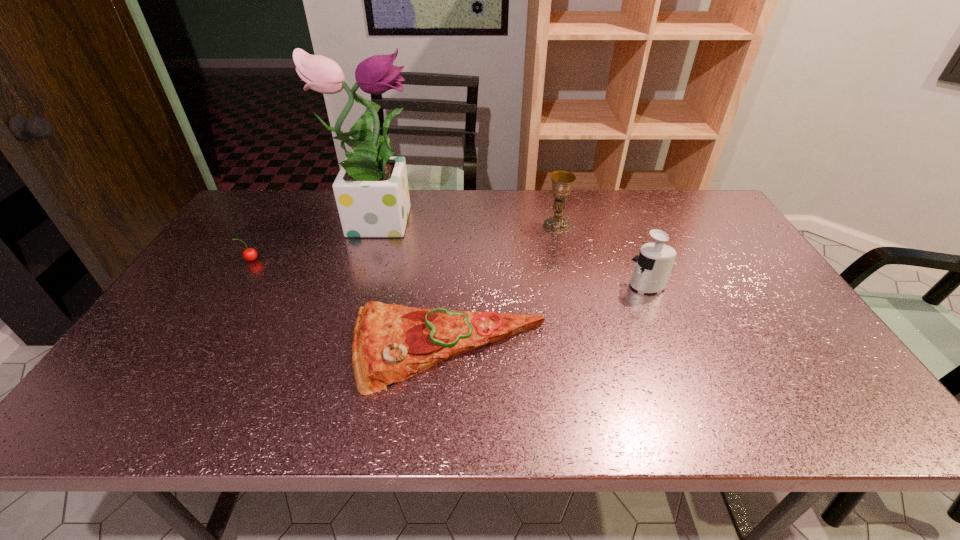
Locate an element on the screen. free spot located on the left of the juicer is located at coordinates (580, 286).

Locate an element on the screen. free spot located 0.120m on the front of the fourth tallest object is located at coordinates (230, 292).

Image resolution: width=960 pixels, height=540 pixels. I want to click on free region located 0.260m on the left of the pizza, so click(x=240, y=350).

At what (x,y) coordinates should I click in order to perform the action: click on flower arrangement at the far edge. Please return your answer as a coordinate pair (x, y). Looking at the image, I should click on (371, 190).

You are a GUI agent. You are given a task and a screenshot of the screen. Output one action in this format:
    pyautogui.click(x=<x>, y=<y>)
    Task: Click on the chalice situated at the far edge
    
    Given the screenshot: What is the action you would take?
    pyautogui.click(x=562, y=181)

Image resolution: width=960 pixels, height=540 pixels. Identify the location of object at the near edge. (391, 343).

Image resolution: width=960 pixels, height=540 pixels. What are the coordinates of `object situated at the left edge` in the screenshot? It's located at (250, 254).

In the image, there is a desktop. Identify the location of vacant space at the far edge. (448, 211).

Find the location of a particular element. free region at the left edge of the desktop is located at coordinates (137, 369).

Image resolution: width=960 pixels, height=540 pixels. In the image, there is a desktop. Find the location of `vacant space at the right edge`. vacant space at the right edge is located at coordinates (769, 344).